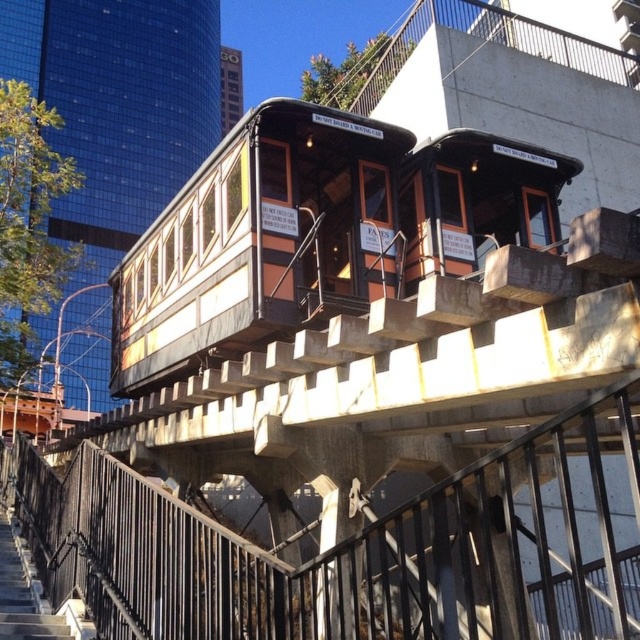
You are a city planner assessing the space between the wooden passenger train at center and the wooden stairs at lower left. If you want to place a 2 meter wide bench between them, will there be enough space?

The wooden passenger train at center is wider than the wooden stairs at lower left, but the exact width difference isn

You are standing on the city street below the cable cars. You notice a specific point marked at coordinates point [316,234]. Which object in the scene does this point belong to?

The point [316,234] is on wooden passenger train at center.

You are a tourist standing at the wooden stairs at lower left, looking towards the wooden passenger train at center. Which direction should you walk to board the train?

The wooden passenger train at center is in front of the wooden stairs at lower left, so you should walk forward towards the wooden passenger train at center to board it.